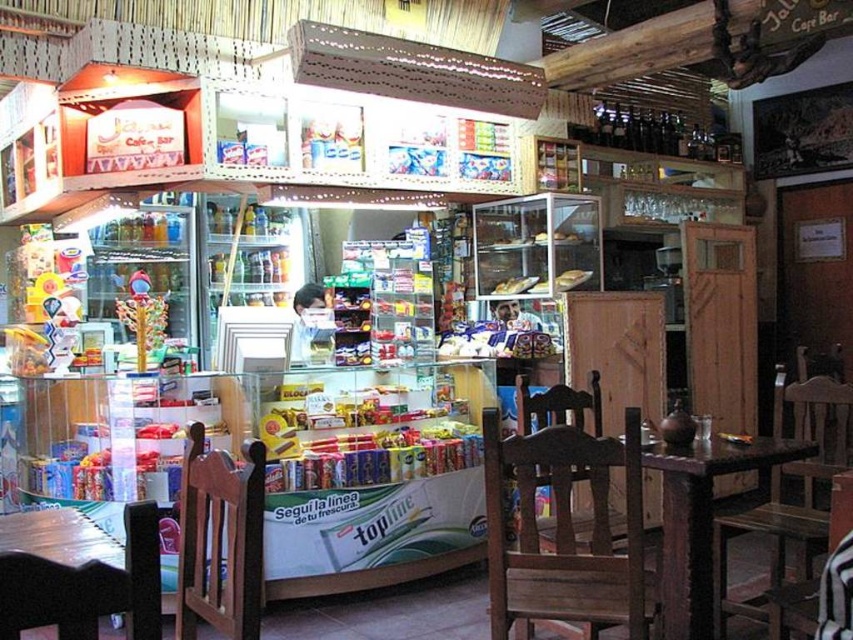
Question: Considering the relative positions of wooden chair at lower left and wooden chair at right in the image provided, where is wooden chair at lower left located with respect to wooden chair at right?

Choices:
 (A) right
 (B) left

Answer: (B)

Question: From the image, what is the correct spatial relationship of brown wooden chair at lower left in relation to dark brown wooden table at center?

Choices:
 (A) left
 (B) right

Answer: (A)

Question: In this image, where is wooden chair at center located relative to wooden chair at right?

Choices:
 (A) left
 (B) right

Answer: (A)

Question: Which point appears farthest from the camera in this image?

Choices:
 (A) click(x=683, y=458)
 (B) click(x=822, y=522)
 (C) click(x=640, y=493)

Answer: (B)

Question: Which is nearer to the dark brown wooden table at center?

Choices:
 (A) wooden chair at lower left
 (B) wooden chair at right
 (C) wooden chair at center

Answer: (B)

Question: Based on their relative distances, which object is nearer to the wooden chair at center?

Choices:
 (A) wooden chair at lower left
 (B) wooden chair at right

Answer: (B)